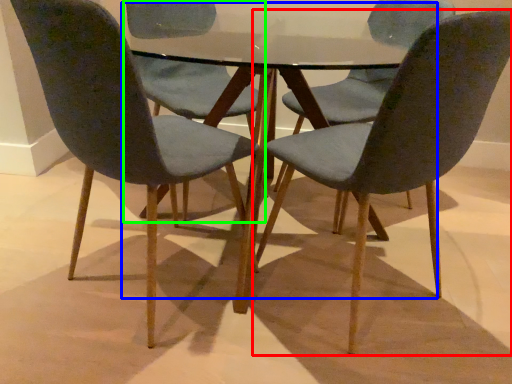
Question: Estimate the real-world distances between objects in this image. Which object is farther from chair (highlighted by a red box), round table (highlighted by a blue box) or chair (highlighted by a green box)?

Choices:
 (A) round table
 (B) chair

Answer: (B)